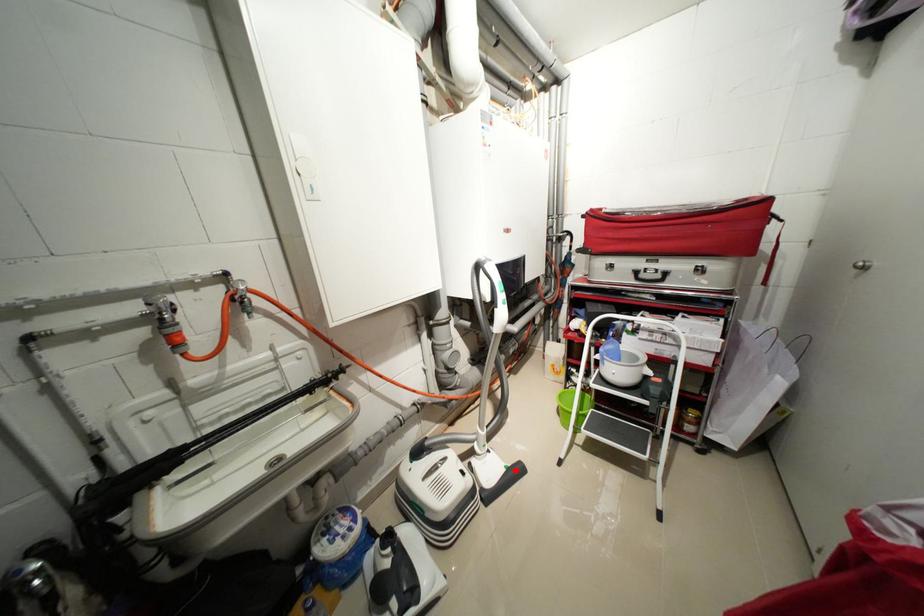
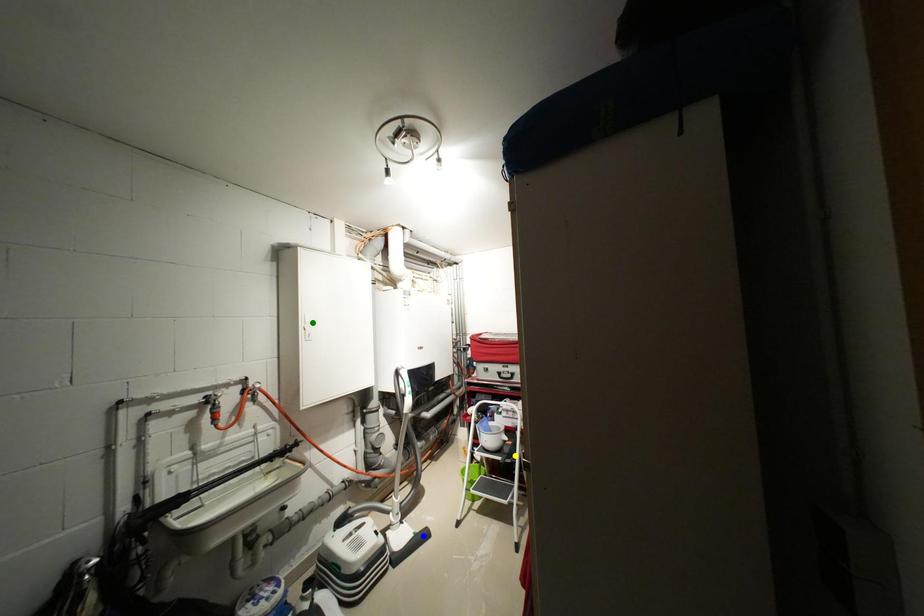
Question: I am providing you with two images of the same scene from different viewpoints. A red point is marked on the first image. You are given multiple points on the second image. In image 2, which mark is for the same physical point as the one in image 1?

Choices:
 (A) yellow point
 (B) green point
 (C) blue point

Answer: (C)